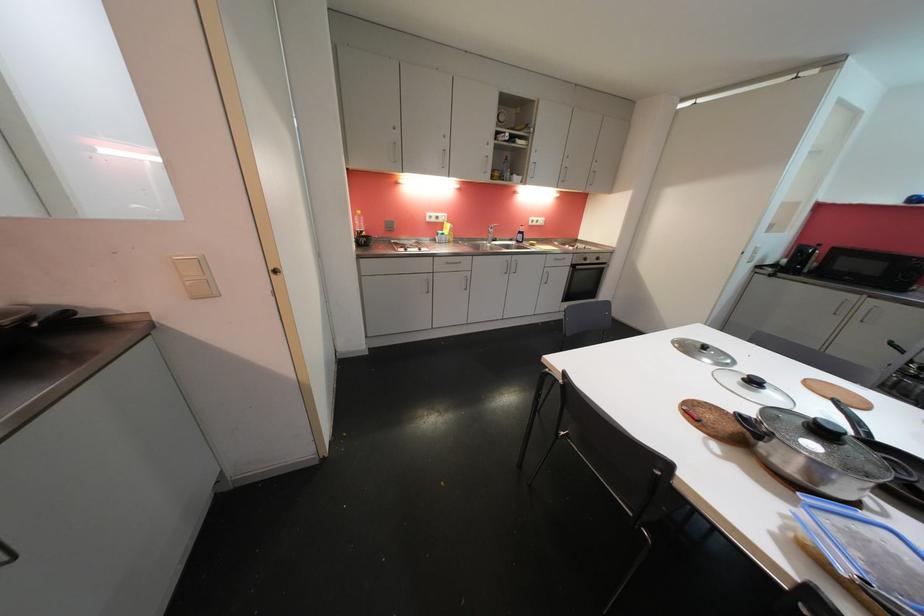
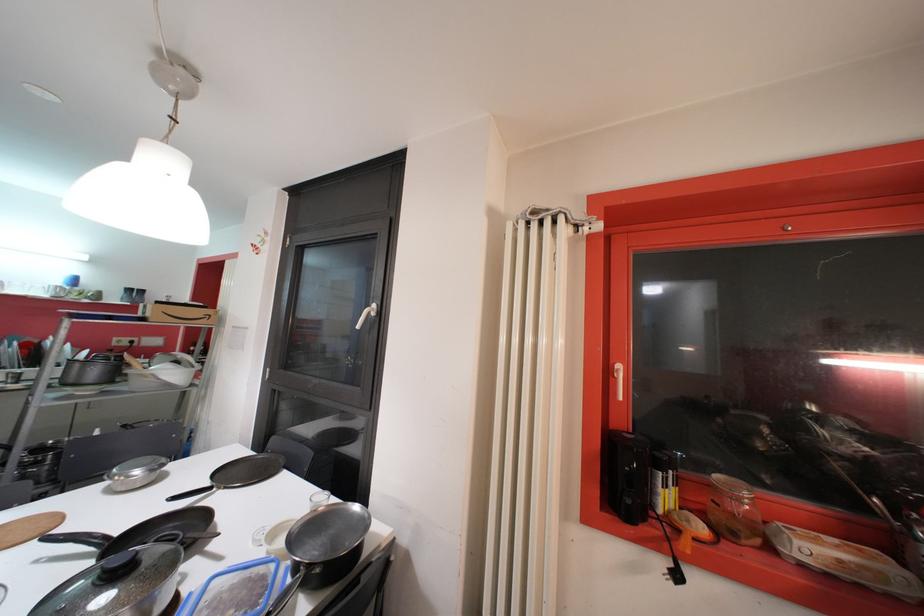
Find the pixel in the second image that matches (x=862, y=540) in the first image.

(222, 608)